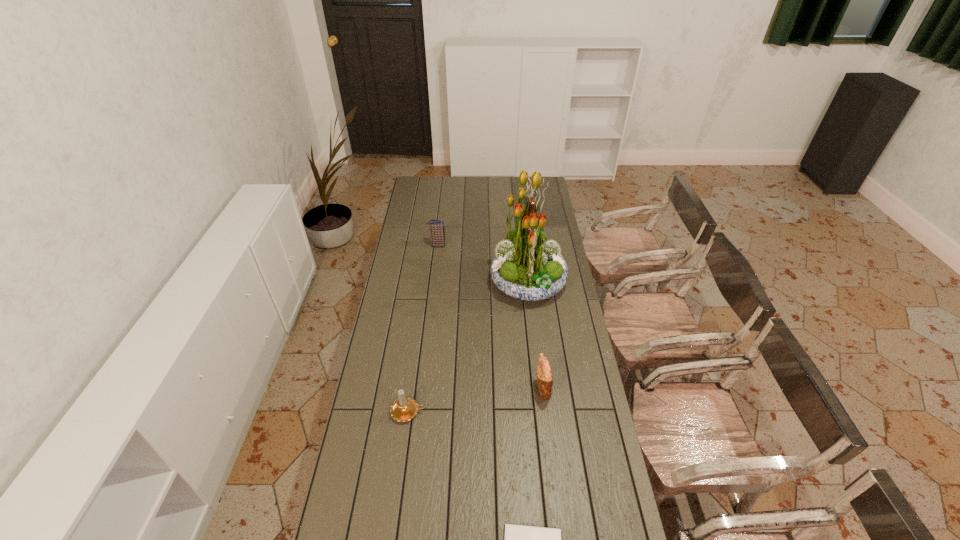
This screenshot has height=540, width=960. Find the location of `vacant space located on the open side of the right clutch bag`. vacant space located on the open side of the right clutch bag is located at coordinates (455, 389).

This screenshot has height=540, width=960. In order to click on free region located 0.150m on the open side of the right clutch bag in this screenshot , I will do `click(495, 389)`.

Identify the location of free space located on the open side of the right clutch bag. (450, 389).

Locate an element on the screen. This screenshot has height=540, width=960. free space located 0.120m on the back of the candle is located at coordinates (x=414, y=373).

At what (x,y) coordinates should I click in order to perform the action: click on clutch bag that is positioned at the left edge. Please return your answer as a coordinate pair (x, y). The image size is (960, 540). Looking at the image, I should click on coord(437,232).

Image resolution: width=960 pixels, height=540 pixels. What are the coordinates of `candle that is at the left edge` in the screenshot? It's located at (404, 409).

Where is `object located at the right edge`? This screenshot has width=960, height=540. object located at the right edge is located at coordinates (526, 267).

At what (x,y) coordinates should I click in order to perform the action: click on vacant area at the far edge of the desktop. Please return your answer as a coordinate pair (x, y). Looking at the image, I should click on (474, 188).

Locate an element on the screen. free spot at the left edge of the desktop is located at coordinates (365, 431).

This screenshot has height=540, width=960. Identify the location of free space at the right edge of the desktop. (552, 208).